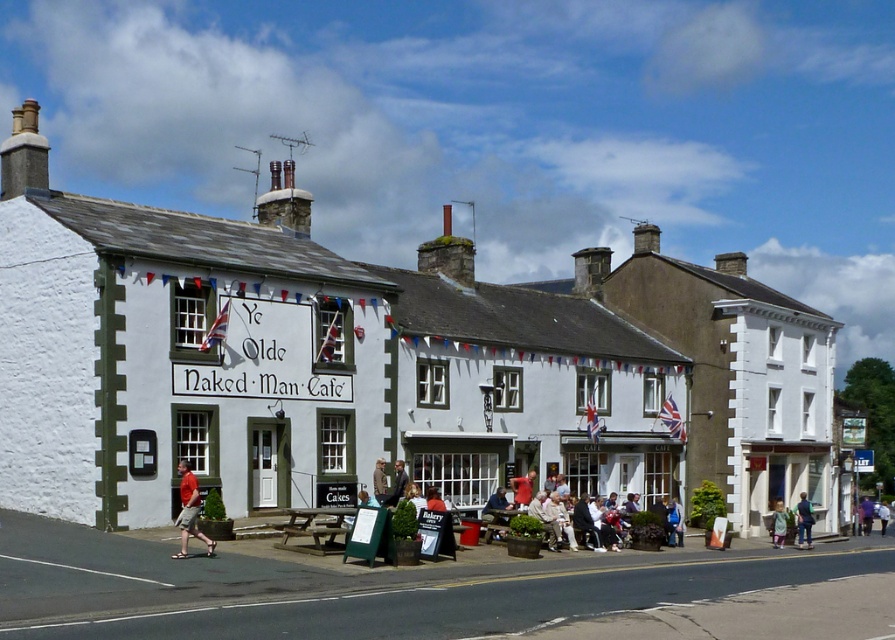
Question: Is blue denim jeans at lower right smaller than red shirt at center?

Choices:
 (A) yes
 (B) no

Answer: (B)

Question: Which object is the farthest from the blue denim jeans at lower right?

Choices:
 (A) matte brown jacket at center
 (B) red cotton shorts at lower left

Answer: (B)

Question: Which point is closer to the camera taking this photo?

Choices:
 (A) (501, 509)
 (B) (800, 509)
 (C) (783, 509)
 (D) (885, 508)

Answer: (A)

Question: Can you confirm if purple fabric jacket at center is positioned to the right of white fabric jacket at center?

Choices:
 (A) yes
 (B) no

Answer: (B)

Question: Observing the image, what is the correct spatial positioning of red cotton shorts at lower left in reference to brown leather jacket at center?

Choices:
 (A) above
 (B) below

Answer: (A)

Question: Estimate the real-world distances between objects in this image. Which object is closer to the leather jacket at center?

Choices:
 (A) light blue denim jacket at center
 (B) red shirt at center
 (C) purple fabric jacket at center
 (D) khaki fabric jacket at center

Answer: (D)